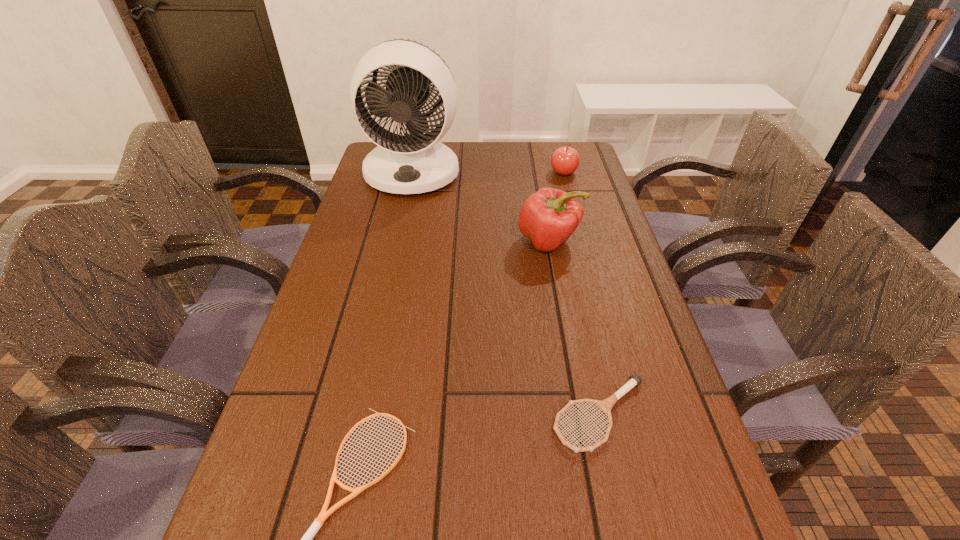
The height and width of the screenshot is (540, 960). I want to click on fan located in the far edge section of the desktop, so click(x=414, y=163).

This screenshot has height=540, width=960. Find the location of `apple present at the far edge`. apple present at the far edge is located at coordinates (565, 160).

Locate an element on the screen. object present at the left edge is located at coordinates (414, 163).

Where is `bell pepper positioned at the right edge`? The height and width of the screenshot is (540, 960). bell pepper positioned at the right edge is located at coordinates (549, 217).

Where is `apple present at the right edge`? Image resolution: width=960 pixels, height=540 pixels. apple present at the right edge is located at coordinates (565, 160).

Image resolution: width=960 pixels, height=540 pixels. I want to click on tennis racket at the right edge, so click(x=605, y=405).

At what (x,y) coordinates should I click in order to perform the action: click on object present at the far left corner. Please return your answer as a coordinate pair (x, y). Looking at the image, I should click on (414, 163).

Locate an element on the screen. This screenshot has height=540, width=960. object located at the far right corner is located at coordinates (565, 160).

At what (x,y) coordinates should I click in order to perform the action: click on free space at the far edge of the desktop. Please return your answer as a coordinate pair (x, y). Image resolution: width=960 pixels, height=540 pixels. Looking at the image, I should click on (519, 166).

I want to click on vacant space at the left edge of the desktop, so click(x=379, y=327).